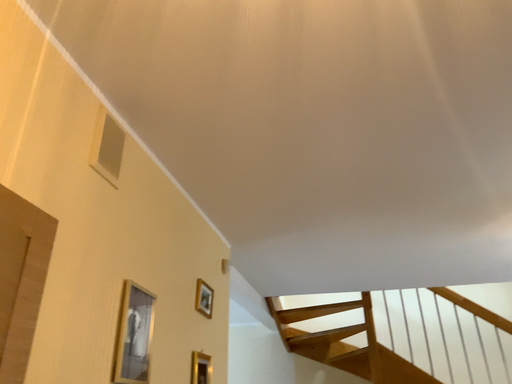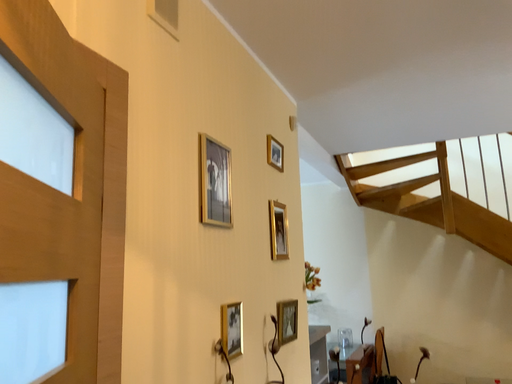
Question: Which way did the camera rotate in the video?

Choices:
 (A) rotated downward
 (B) rotated upward

Answer: (A)